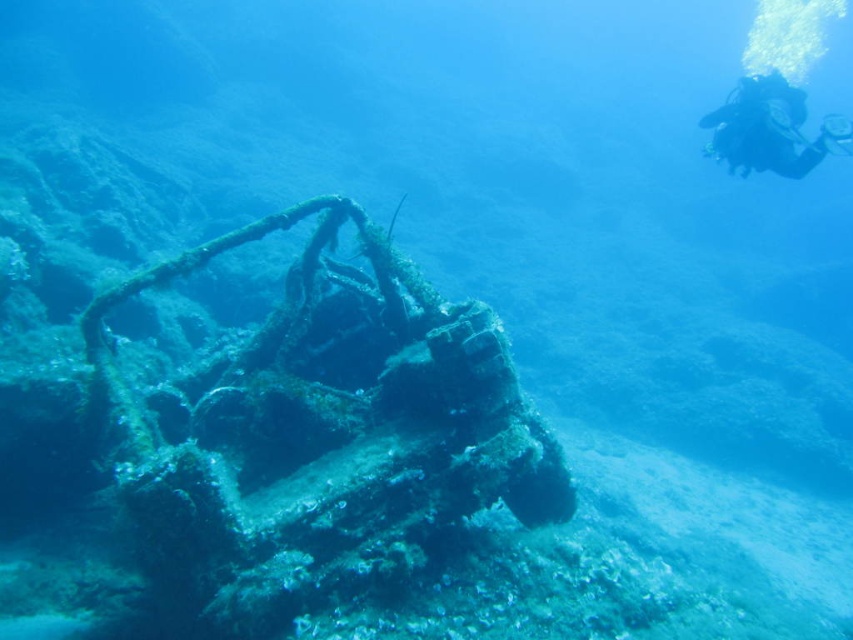
Can you confirm if rusty metal shipwreck at center is taller than black scuba diver at upper right?

Yes, rusty metal shipwreck at center is taller than black scuba diver at upper right.

Between point (265, 616) and point (717, 131), which one is positioned in front?

Positioned in front is point (265, 616).

The height and width of the screenshot is (640, 853). In order to click on rusty metal shipwreck at center in this screenshot , I will do point(321,435).